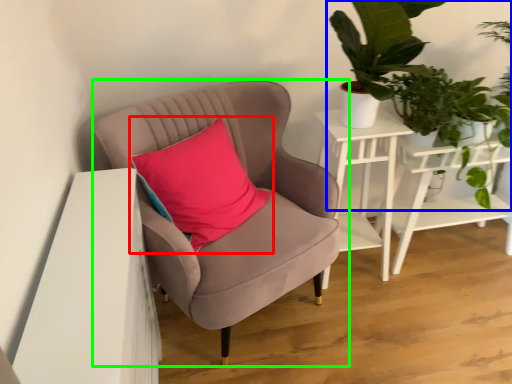
Question: Considering the real-world distances, which object is closest to pillow (highlighted by a red box)? houseplant (highlighted by a blue box) or chair (highlighted by a green box).

Choices:
 (A) houseplant
 (B) chair

Answer: (B)